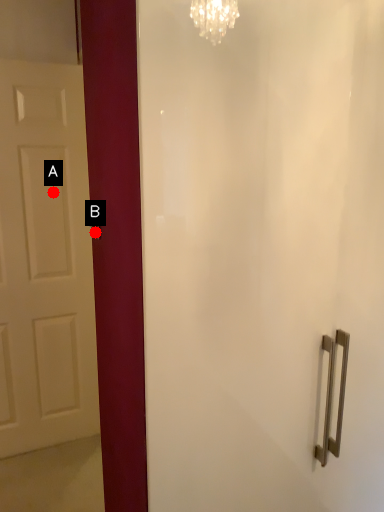
Question: Two points are circled on the image, labeled by A and B beside each circle. Which point appears closest to the camera in this image?

Choices:
 (A) A is closer
 (B) B is closer

Answer: (B)